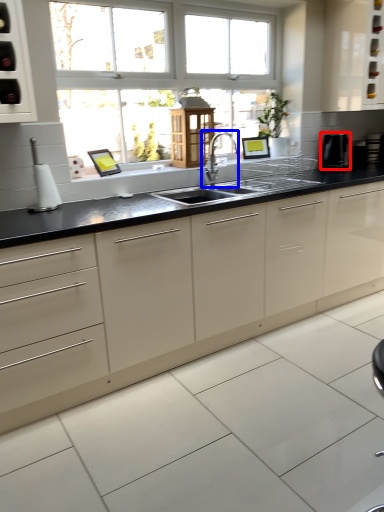
Question: Which object is closer to the camera taking this photo, appliance (highlighted by a red box) or tap (highlighted by a blue box)?

Choices:
 (A) appliance
 (B) tap

Answer: (B)